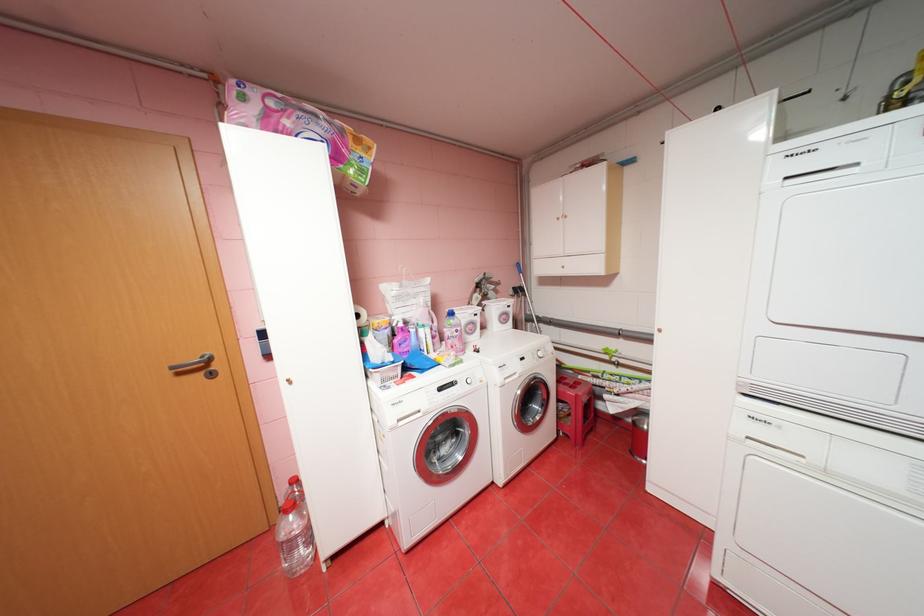
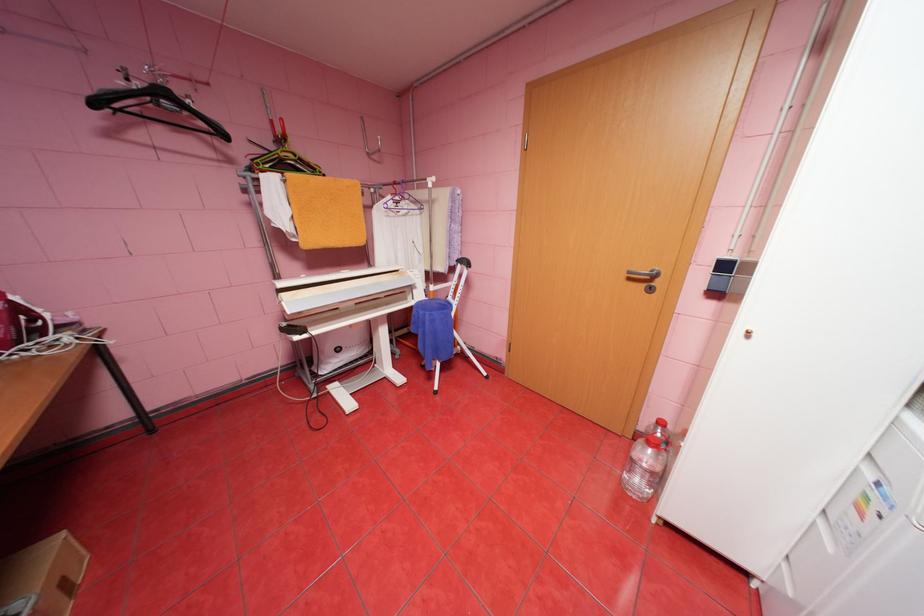
Locate, in the second image, the point that corresponds to (x=209, y=374) in the first image.

(650, 285)